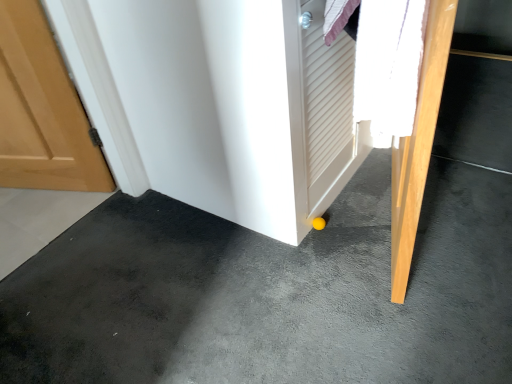
In order to face light wood door at lower right, should I rotate leftwards or rightwards?

Turn right by 20.835 degrees to look at light wood door at lower right.

Where is `light wood door at lower right`? Image resolution: width=512 pixels, height=384 pixels. light wood door at lower right is located at coordinates (418, 144).

Describe the element at coordinates (418, 144) in the screenshot. I see `light wood door at lower right` at that location.

Image resolution: width=512 pixels, height=384 pixels. Identify the location of yellow rubber ball at lower center. (270, 293).

Describe the element at coordinates (270, 293) in the screenshot. This screenshot has width=512, height=384. I see `yellow rubber ball at lower center` at that location.

You are a GUI agent. You are given a task and a screenshot of the screen. Output one action in this format:
    pyautogui.click(x=<x>, y=<y>)
    Task: Click on the light wood door at lower right
    Image resolution: width=512 pixels, height=384 pixels.
    Given the screenshot: What is the action you would take?
    pyautogui.click(x=418, y=144)

Considering the positions of objects light wood door at lower right and yellow rubber ball at lower center in the image provided, who is more to the right, light wood door at lower right or yellow rubber ball at lower center?

From the viewer's perspective, light wood door at lower right appears more on the right side.

Considering their positions, is light wood door at lower right located in front of or behind yellow rubber ball at lower center?

light wood door at lower right is behind yellow rubber ball at lower center.

Considering the points (429, 124) and (175, 261), which point is in front, point (429, 124) or point (175, 261)?

Point (429, 124)

From the image's perspective, is light wood door at lower right below yellow rubber ball at lower center?

Actually, light wood door at lower right appears above yellow rubber ball at lower center in the image.

From a real-world perspective, relative to yellow rubber ball at lower center, is light wood door at lower right vertically above or below?

light wood door at lower right is above yellow rubber ball at lower center.

Between light wood door at lower right and yellow rubber ball at lower center, which one has smaller width?

Thinner between the two is light wood door at lower right.

Considering the relative sizes of light wood door at lower right and yellow rubber ball at lower center in the image provided, is light wood door at lower right taller than yellow rubber ball at lower center?

Correct, light wood door at lower right is much taller as yellow rubber ball at lower center.

In the scene shown: Considering the sizes of light wood door at lower right and yellow rubber ball at lower center in the image, is light wood door at lower right bigger or smaller than yellow rubber ball at lower center?

In the image, light wood door at lower right appears to be smaller than yellow rubber ball at lower center.

Is light wood door at lower right completely or partially outside of yellow rubber ball at lower center?

Yes, light wood door at lower right is outside of yellow rubber ball at lower center.

Is light wood door at lower right not near yellow rubber ball at lower center?

That's not correct — light wood door at lower right is a little close to yellow rubber ball at lower center.

Is light wood door at lower right oriented away from yellow rubber ball at lower center?

Yes, light wood door at lower right is facing away from yellow rubber ball at lower center.

Identify the location of door that is above the yellow rubber ball at lower center (from a real-world perspective). (418, 144).

Which object is positioned more to the left, yellow rubber ball at lower center or light wood door at lower right?

yellow rubber ball at lower center.

Is yellow rubber ball at lower center closer to camera compared to light wood door at lower right?

Yes, it is.

Considering the points (85, 354) and (426, 88), which point is behind, point (85, 354) or point (426, 88)?

Point (85, 354)

From the image's perspective, would you say yellow rubber ball at lower center is shown under light wood door at lower right?

Indeed, from the image's perspective, yellow rubber ball at lower center is shown beneath light wood door at lower right.

From a real-world perspective, does yellow rubber ball at lower center sit lower than light wood door at lower right?

Correct, in the physical world, yellow rubber ball at lower center is lower than light wood door at lower right.

Considering the sizes of objects yellow rubber ball at lower center and light wood door at lower right in the image provided, who is wider, yellow rubber ball at lower center or light wood door at lower right?

yellow rubber ball at lower center is wider.

Is yellow rubber ball at lower center taller or shorter than light wood door at lower right?

Clearly, yellow rubber ball at lower center is shorter compared to light wood door at lower right.

Can you confirm if yellow rubber ball at lower center is smaller than light wood door at lower right?

No.

Is yellow rubber ball at lower center not within light wood door at lower right?

Yes, yellow rubber ball at lower center is outside of light wood door at lower right.

From the picture: Is yellow rubber ball at lower center not near light wood door at lower right?

No, yellow rubber ball at lower center is not far from light wood door at lower right.

Is yellow rubber ball at lower center looking in the opposite direction of light wood door at lower right?

That's not correct — yellow rubber ball at lower center is not looking away from light wood door at lower right.

What are the coordinates of `concrete that is below the light wood door at lower right (from the image's perspective)` in the screenshot? It's located at (270, 293).

Find the location of a particular element. The width and height of the screenshot is (512, 384). door above the yellow rubber ball at lower center (from a real-world perspective) is located at coordinates (418, 144).

In order to click on concrete on the left of the light wood door at lower right in this screenshot , I will do `click(270, 293)`.